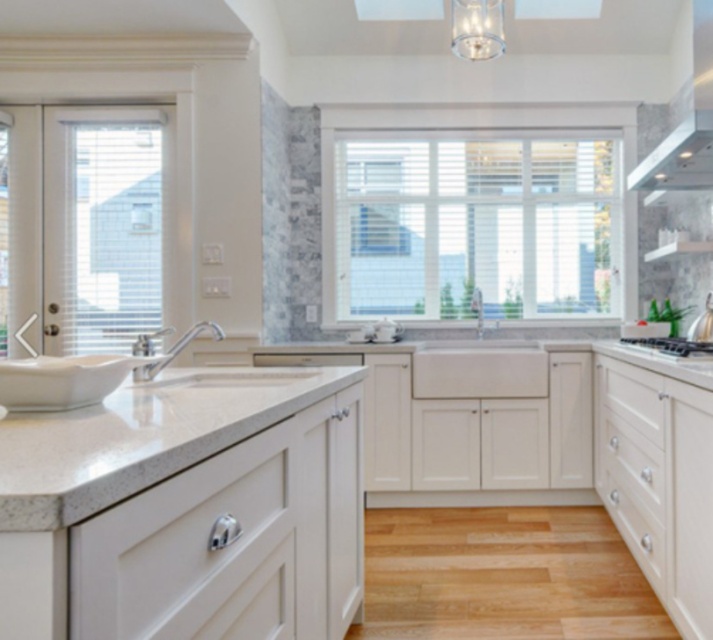
Question: Estimate the real-world distances between objects in this image. Which object is farther from the satin nickel stove at right?

Choices:
 (A) white glossy exhaust hood at upper right
 (B) white granite countertop at lower left
 (C) satin nickel faucet at center
 (D) white wood window at center

Answer: (C)

Question: In this image, where is white granite countertop at lower left located relative to white glossy exhaust hood at upper right?

Choices:
 (A) right
 (B) left

Answer: (B)

Question: Considering the real-world distances, which object is farthest from the satin nickel faucet at center?

Choices:
 (A) white glossy exhaust hood at upper right
 (B) white granite countertop at lower left
 (C) white wood window at center

Answer: (C)

Question: Does white wood window at center appear on the left side of white granite countertop at lower left?

Choices:
 (A) yes
 (B) no

Answer: (B)

Question: Can you confirm if white wood window at center is positioned above white glossy exhaust hood at upper right?

Choices:
 (A) no
 (B) yes

Answer: (A)

Question: Which point is closer to the camera?

Choices:
 (A) (657, 342)
 (B) (178, 394)
 (C) (697, 177)

Answer: (B)